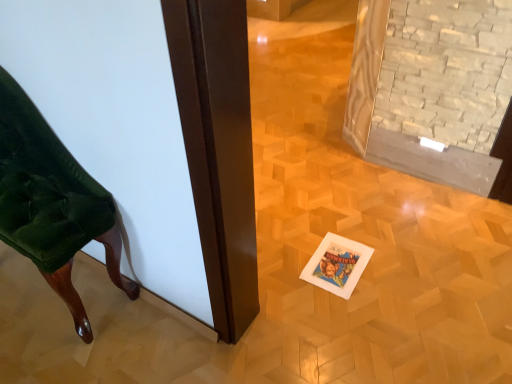
Locate an element on the screen. Image resolution: width=512 pixels, height=384 pixels. free space to the left of white paper postcard at center is located at coordinates (286, 266).